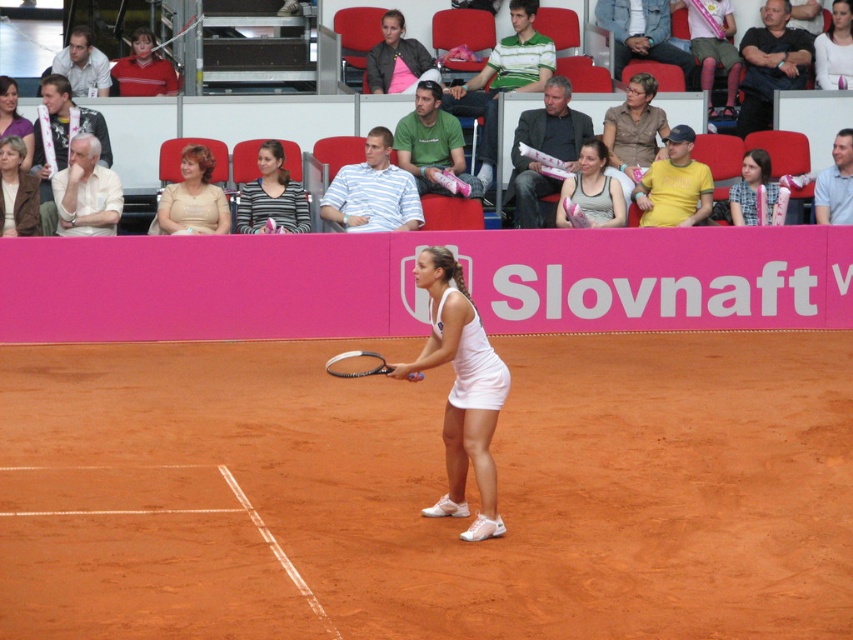
Question: Which of these objects is positioned closest to the matte white tennis skirt at center?

Choices:
 (A) white matte tennis skirt at center
 (B) matte beige blouse at center
 (C) striped shirt at center
 (D) smooth white tank top at center

Answer: (B)

Question: Is clay tennis court at center thinner than matte gray tank top at center?

Choices:
 (A) no
 (B) yes

Answer: (A)

Question: Which point is farther from the camera taking this photo?

Choices:
 (A) (202, 163)
 (B) (300, 228)

Answer: (B)

Question: Can you confirm if matte gray tank top at center is smaller than matte pink dress at upper right?

Choices:
 (A) no
 (B) yes

Answer: (A)

Question: Is white matte tennis skirt at center to the right of brown leather jacket at upper left from the viewer's perspective?

Choices:
 (A) yes
 (B) no

Answer: (A)

Question: Estimate the real-world distances between objects in this image. Which object is farther from the matte pink dress at upper right?

Choices:
 (A) brown leather jacket at upper left
 (B) black rubber tennis racket at center

Answer: (A)